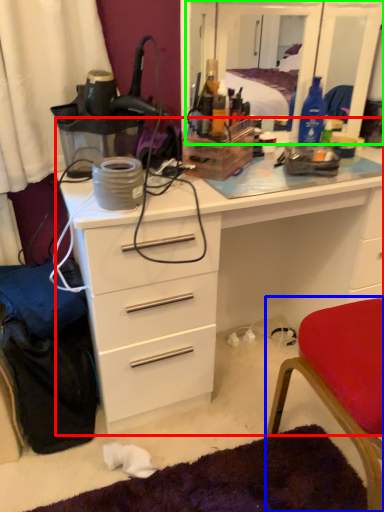
Question: Which object is positioned closest to chest of drawers (highlighted by a red box)? Select from chair (highlighted by a blue box) and mirror (highlighted by a green box).

Choices:
 (A) chair
 (B) mirror

Answer: (A)